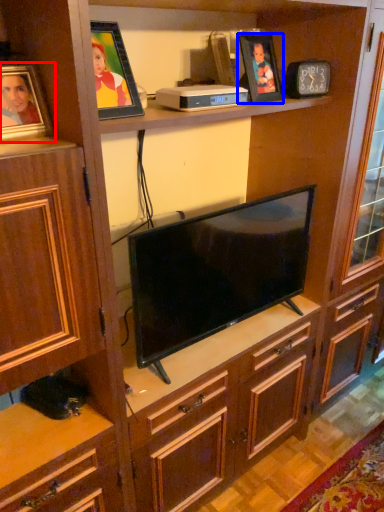
Question: Which point is further to the camera, picture frame (highlighted by a red box) or picture frame (highlighted by a blue box)?

Choices:
 (A) picture frame
 (B) picture frame

Answer: (B)